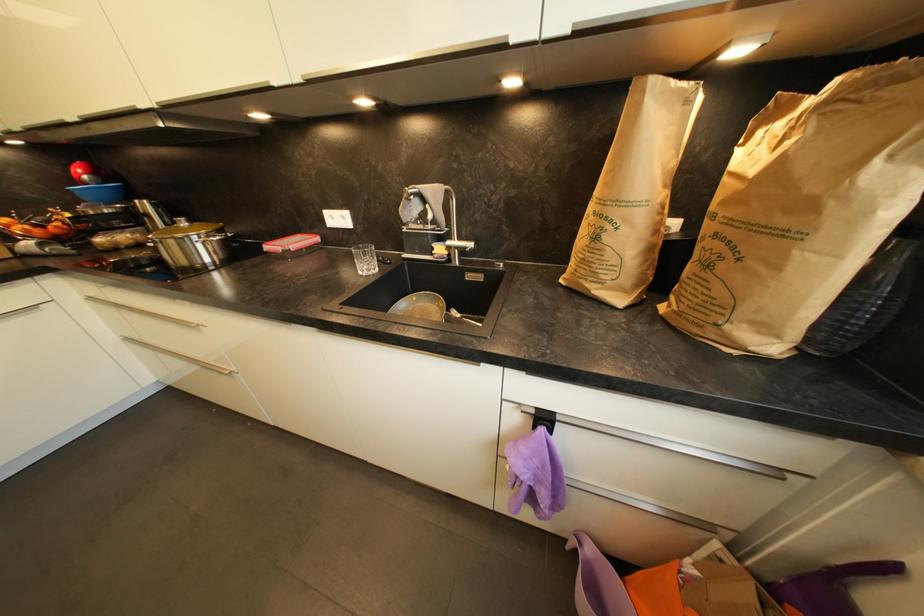
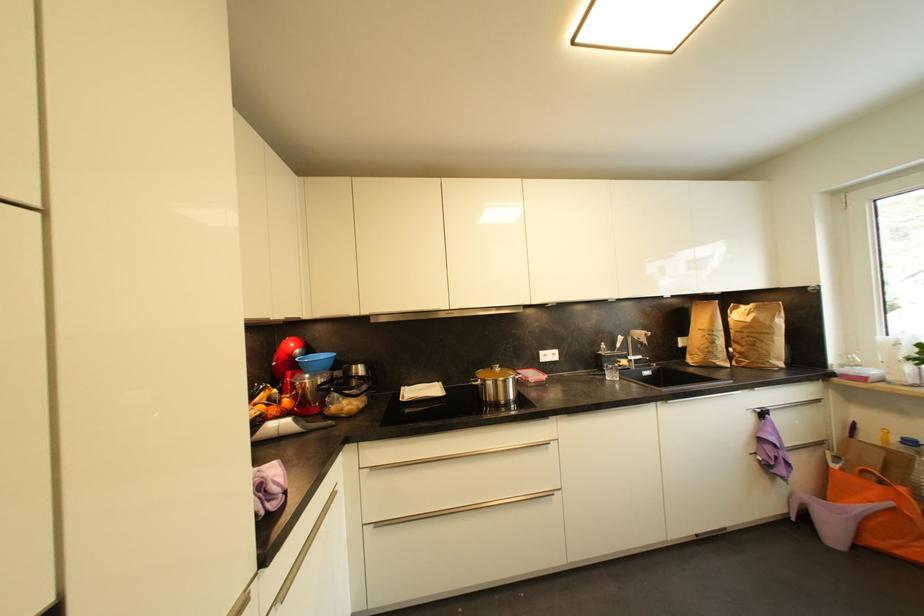
Where in the second image is the point corresponding to point 44,233 from the first image?

(277, 411)